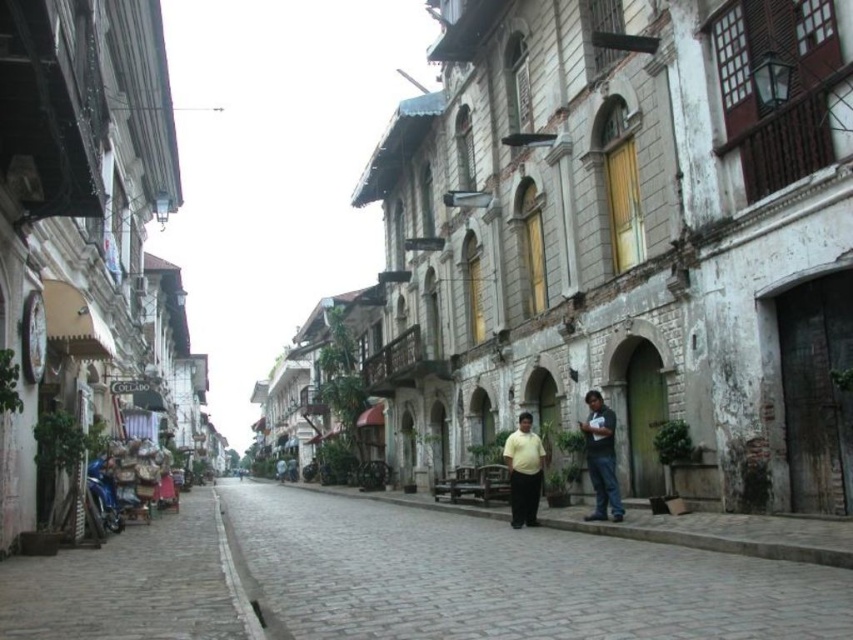
Question: Which point is closer to the camera taking this photo?

Choices:
 (A) (96, 460)
 (B) (512, 598)
 (C) (51, 580)
 (D) (531, 481)

Answer: (B)

Question: Is yellow cotton shirt at center positioned before yellow matte shirt at center?

Choices:
 (A) yes
 (B) no

Answer: (A)

Question: Which point appears farthest from the camera in this image?

Choices:
 (A) (281, 460)
 (B) (96, 493)
 (C) (310, 621)

Answer: (A)

Question: Which point is closer to the camera taking this photo?

Choices:
 (A) (532, 467)
 (B) (729, 582)

Answer: (B)

Question: Does yellow cotton shirt at center have a greater width compared to dark gray shirt at center?

Choices:
 (A) no
 (B) yes

Answer: (B)

Question: Is the position of yellow matte shirt at center less distant than that of light blue fabric couple at center?

Choices:
 (A) no
 (B) yes

Answer: (B)